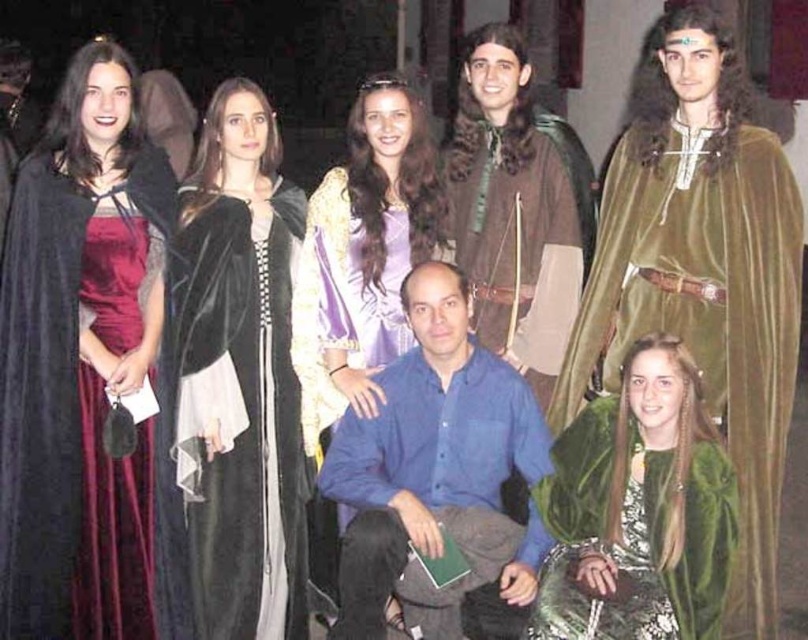
Where is the velvet green cape at upper right located in the image?

The velvet green cape at upper right is located at point (705, 312) in the image.

You are a photographer at the event and want to capture a photo that includes both the velvet green cape at upper right and the green velvet cape at lower right. Given their distance apart, can you fit both into a single frame without moving the camera position?

The velvet green cape at upper right is 29.69 inches from the green velvet cape at lower right. Since this distance is within the camera frame, both can be captured in a single photo without moving the camera position.